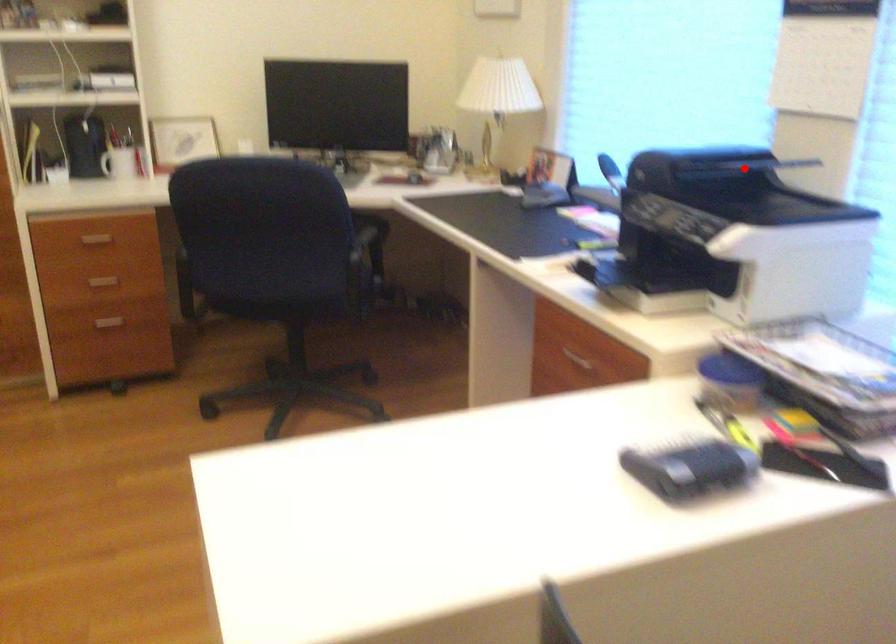
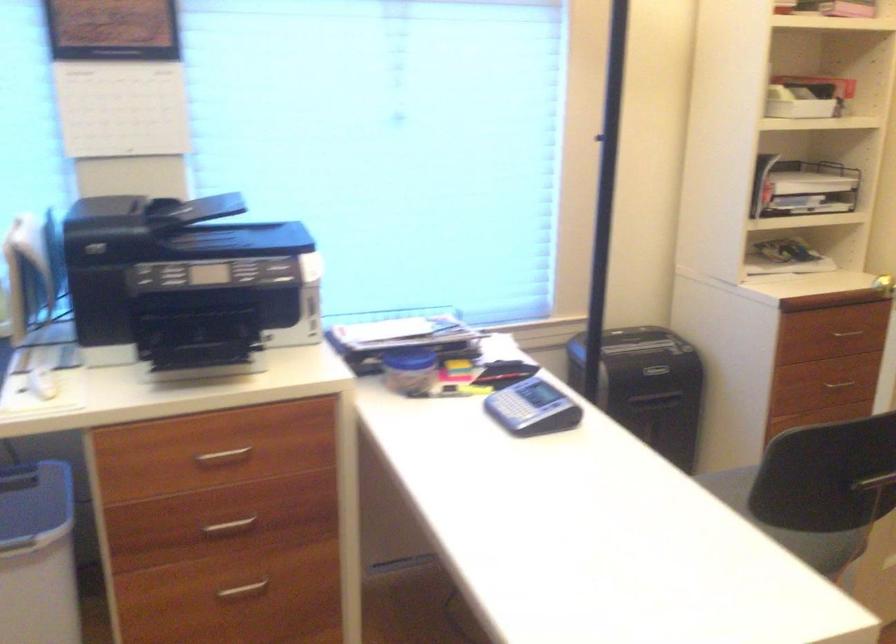
Find the pixel in the second image that matches the highlighted location in the first image.

(199, 209)